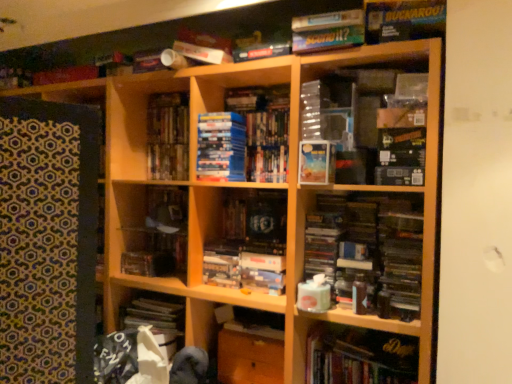
Question: Is hardcover book at lower right, arranged as the first book when ordered from the bottom, surrounding wooden shelf at center, marked as the second cabinet in a right-to-left arrangement?

Choices:
 (A) no
 (B) yes

Answer: (A)

Question: Does hardcover book at lower right, arranged as the first book when ordered from the bottom, have a larger size compared to wooden shelf at center, the 1th cabinet when ordered from left to right?

Choices:
 (A) yes
 (B) no

Answer: (A)

Question: Is hardcover book at lower right, arranged as the first book when ordered from the bottom, smaller than wooden shelf at center, which ranks as the second cabinet in bottom-to-top order?

Choices:
 (A) yes
 (B) no

Answer: (B)

Question: From a real-world perspective, does hardcover book at lower right, acting as the sixth book starting from the top, stand above wooden shelf at center, which is the 1th cabinet from top to bottom?

Choices:
 (A) yes
 (B) no

Answer: (B)

Question: Is the depth of hardcover book at lower right, acting as the sixth book starting from the top, less than that of wooden shelf at center, marked as the second cabinet in a right-to-left arrangement?

Choices:
 (A) no
 (B) yes

Answer: (B)

Question: From a real-world perspective, is hardcover book at lower right, arranged as the first book when ordered from the bottom, below wooden shelf at center, the 1th cabinet when ordered from left to right?

Choices:
 (A) yes
 (B) no

Answer: (A)

Question: Considering the relative positions of wooden cabinet at center, the 2th cabinet positioned from the top, and hardcover books at center, marked as the fourth book in a bottom-to-top arrangement, in the image provided, is wooden cabinet at center, the 2th cabinet positioned from the top, behind hardcover books at center, marked as the fourth book in a bottom-to-top arrangement,?

Choices:
 (A) no
 (B) yes

Answer: (A)

Question: Is wooden cabinet at center, the 2th cabinet positioned from the top, to the left of hardcover books at center, which ranks as the 3th book in top-to-bottom order, from the viewer's perspective?

Choices:
 (A) no
 (B) yes

Answer: (A)

Question: Considering the relative sizes of wooden cabinet at center, the 2th cabinet positioned from the top, and hardcover books at center, marked as the fourth book in a bottom-to-top arrangement, in the image provided, is wooden cabinet at center, the 2th cabinet positioned from the top, thinner than hardcover books at center, marked as the fourth book in a bottom-to-top arrangement,?

Choices:
 (A) yes
 (B) no

Answer: (B)

Question: From a real-world perspective, is wooden cabinet at center, which ranks as the second cabinet in left-to-right order, below hardcover books at center, which ranks as the 3th book in top-to-bottom order?

Choices:
 (A) no
 (B) yes

Answer: (B)

Question: Is wooden cabinet at center, which is the 1th cabinet from bottom to top, turned away from hardcover books at center, marked as the fourth book in a bottom-to-top arrangement?

Choices:
 (A) no
 (B) yes

Answer: (A)

Question: Is wooden cabinet at center, which ranks as the second cabinet in left-to-right order, surrounding hardcover books at center, marked as the fourth book in a bottom-to-top arrangement?

Choices:
 (A) no
 (B) yes

Answer: (A)

Question: Is hardcover book at lower right, arranged as the first book when ordered from the bottom, next to wooden cabinet at center, which ranks as the second cabinet in left-to-right order?

Choices:
 (A) yes
 (B) no

Answer: (B)